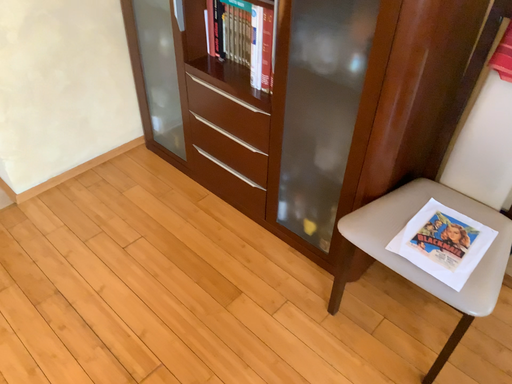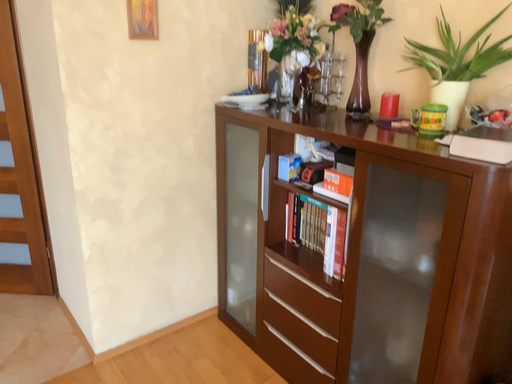
Question: How did the camera likely rotate when shooting the video?

Choices:
 (A) rotated upward
 (B) rotated downward

Answer: (A)